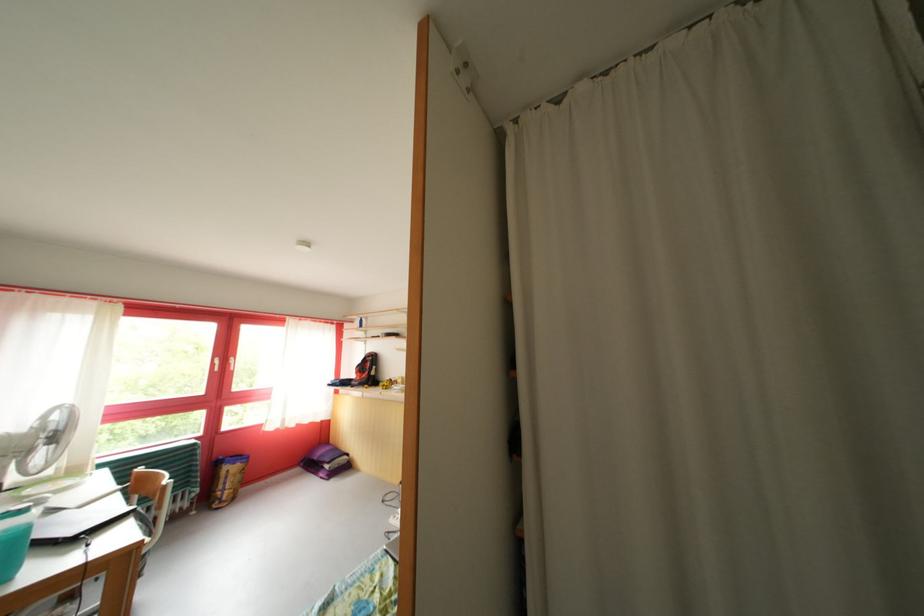
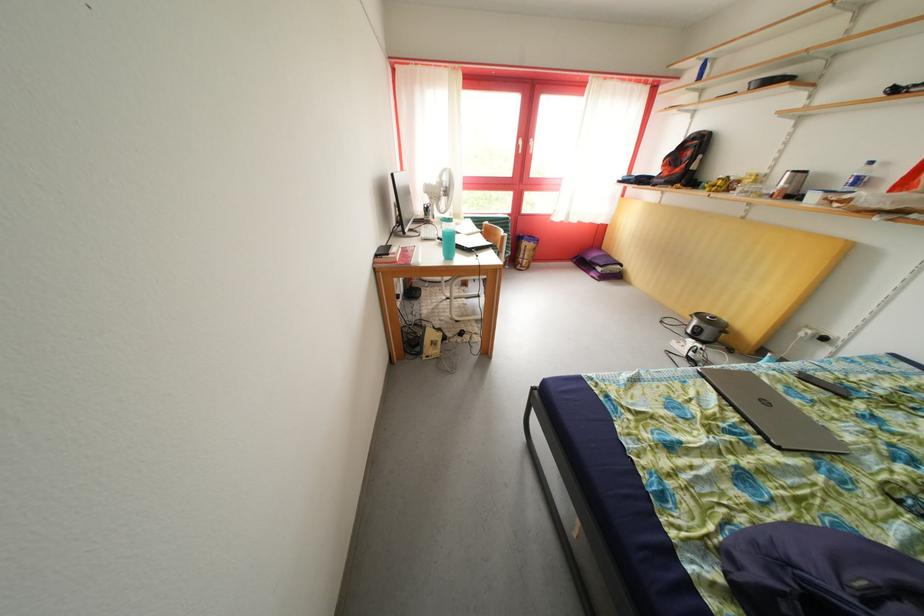
Locate, in the second image, the point that corresponds to pixel 172 493 in the first image.

(511, 243)